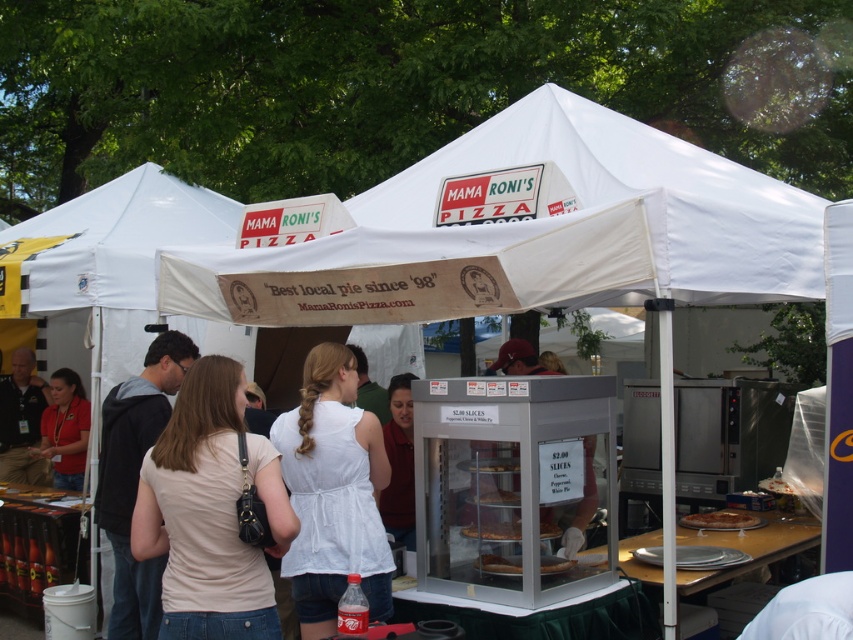
Between stainless steel oven at center and golden brown crusty pizza at center, which one is positioned higher?

stainless steel oven at center is above.

Find the location of `stainless steel oven at center`. stainless steel oven at center is located at coordinates (728, 433).

Locate an element on the screen. The image size is (853, 640). stainless steel oven at center is located at coordinates (728, 433).

Where is `light beige t-shirt at center`? The height and width of the screenshot is (640, 853). light beige t-shirt at center is located at coordinates (202, 515).

Does light beige t-shirt at center appear under matte red shirt at lower left?

No, light beige t-shirt at center is not below matte red shirt at lower left.

The width and height of the screenshot is (853, 640). What are the coordinates of `light beige t-shirt at center` in the screenshot? It's located at (202, 515).

This screenshot has width=853, height=640. I want to click on light beige t-shirt at center, so click(202, 515).

What do you see at coordinates (334, 492) in the screenshot?
I see `white cotton blouse at center` at bounding box center [334, 492].

Is point (341, 400) farther from viewer compared to point (744, 406)?

No, it is in front of (744, 406).

The height and width of the screenshot is (640, 853). Find the location of `white cotton blouse at center`. white cotton blouse at center is located at coordinates (334, 492).